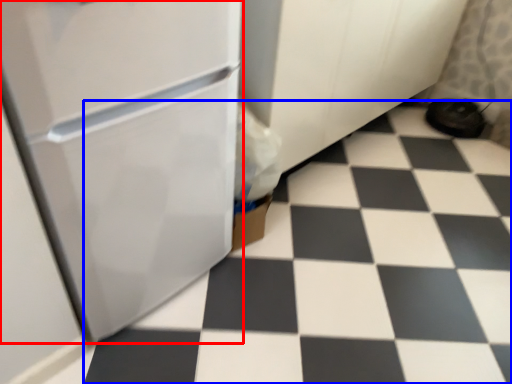
Question: Which point is further to the camera, refrigerator (highlighted by a red box) or tile (highlighted by a blue box)?

Choices:
 (A) refrigerator
 (B) tile

Answer: (B)